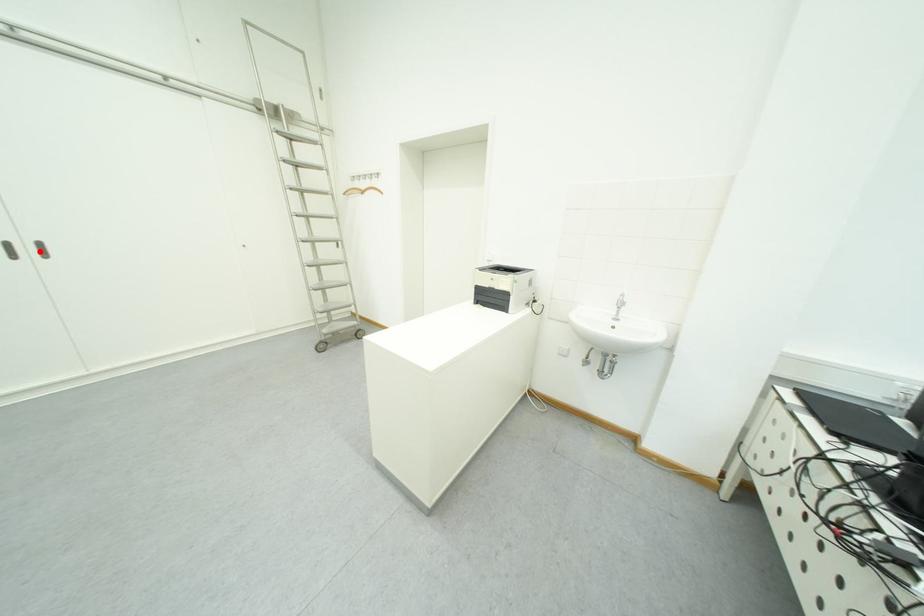
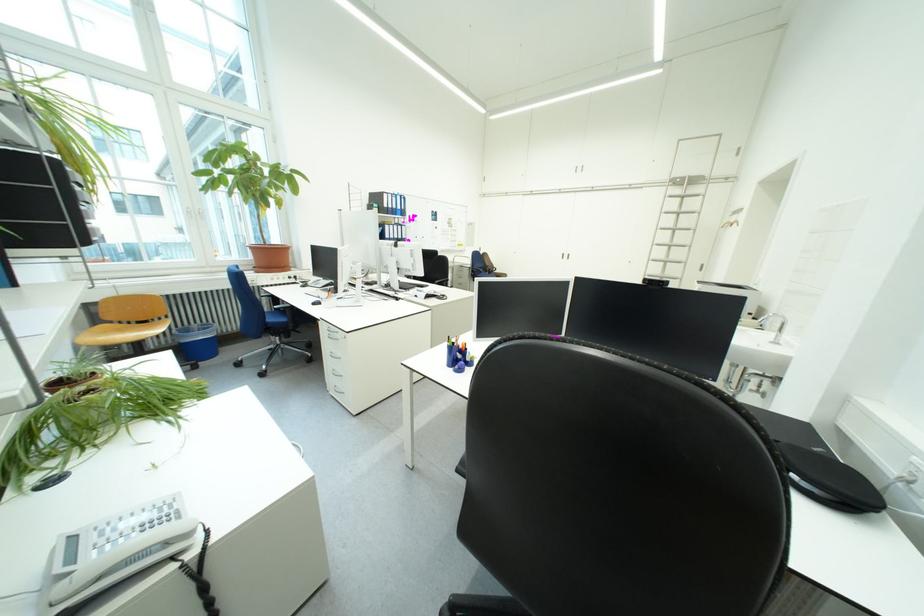
Find the pixel in the second image that matches the highlighted location in the first image.

(577, 257)